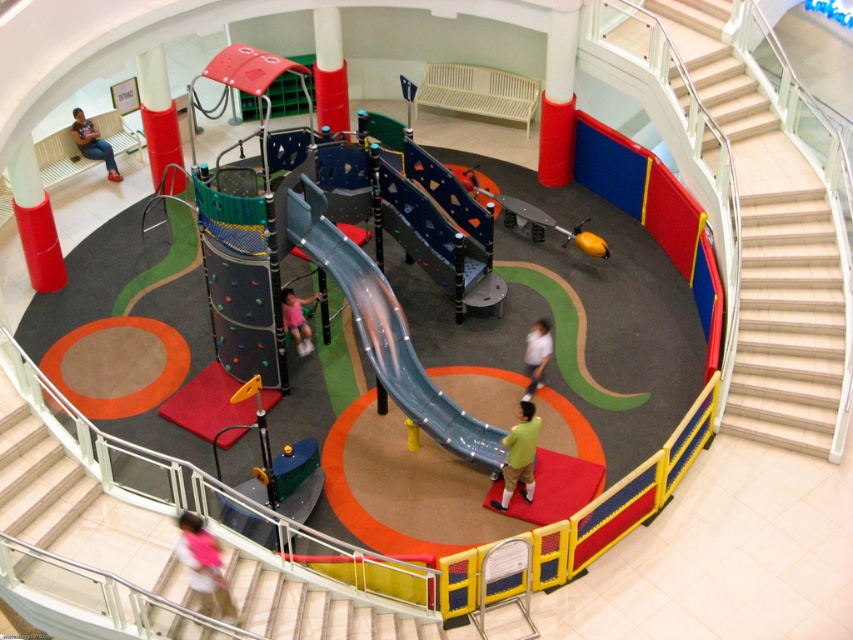
Who is shorter, white glossy stair at lower left or light blue shirt at center?

light blue shirt at center is shorter.

Where is `white glossy stair at lower left`? white glossy stair at lower left is located at coordinates (315, 602).

Who is higher up, green matte shirt at center or light blue shirt at center?

light blue shirt at center is higher up.

Is green matte shirt at center positioned in front of light blue shirt at center?

That is True.

Image resolution: width=853 pixels, height=640 pixels. What are the coordinates of `green matte shirt at center` in the screenshot? It's located at (519, 456).

Between point (187, 561) and point (85, 118), which one is positioned in front?

Positioned in front is point (187, 561).

Can you confirm if pink fabric shirt at lower left is taller than matte pink shirt at upper left?

In fact, pink fabric shirt at lower left may be shorter than matte pink shirt at upper left.

Is point (178, 552) more distant than point (83, 116)?

No, it is in front of (83, 116).

The image size is (853, 640). Find the location of `pink fabric shirt at lower left`. pink fabric shirt at lower left is located at coordinates (202, 566).